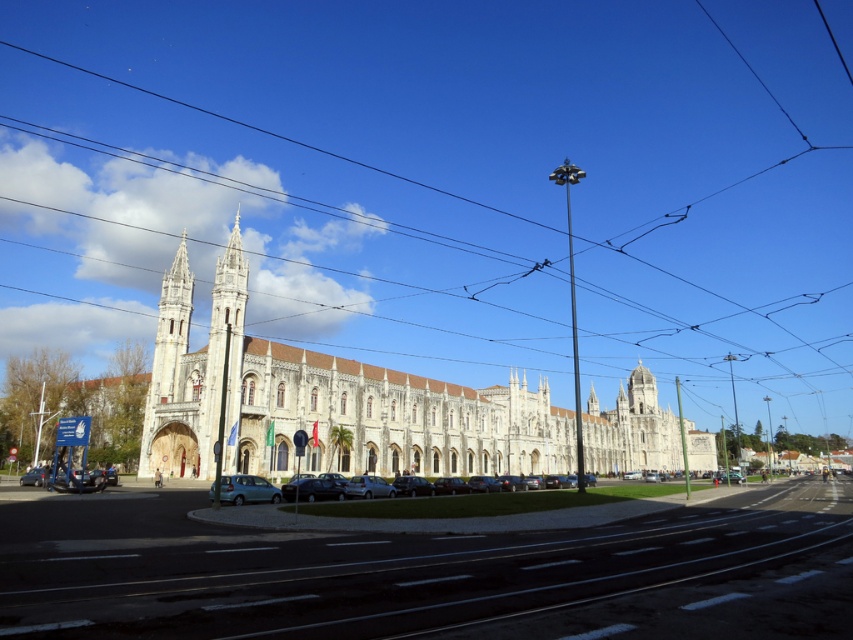
You are a delivery person needing to park your van, which is 20 feet long, between the black wire at upper center and the teal matte car at lower left. Can you fit your van there?

The distance between the black wire at upper center and the teal matte car at lower left is 378.39 feet, so yes, the van can fit there since the space is much longer than the van.

You are a visitor standing in front of the grand historical building. You see the black wire at upper center and the teal matte car at lower left. Which object is taller?

The black wire at upper center is much taller than the teal matte car at lower left.